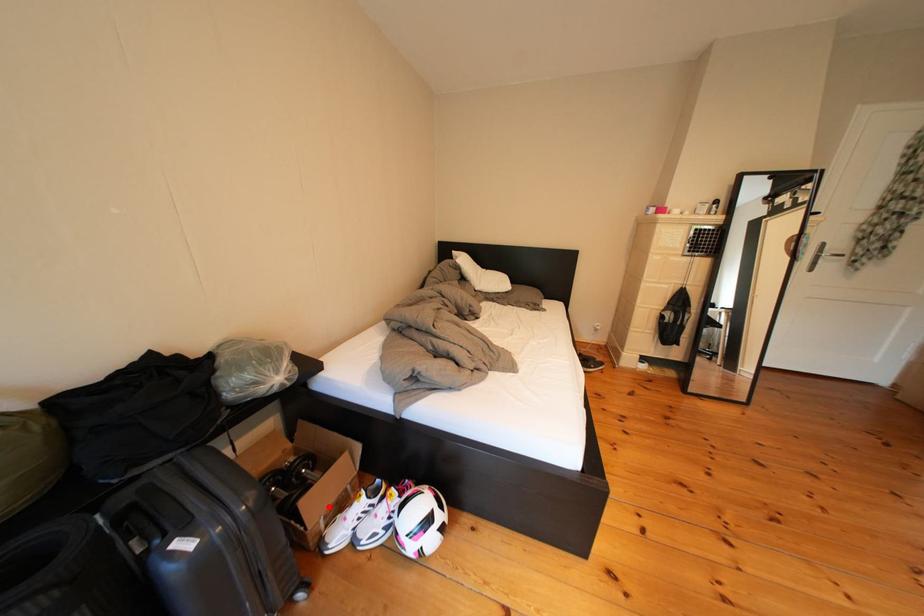
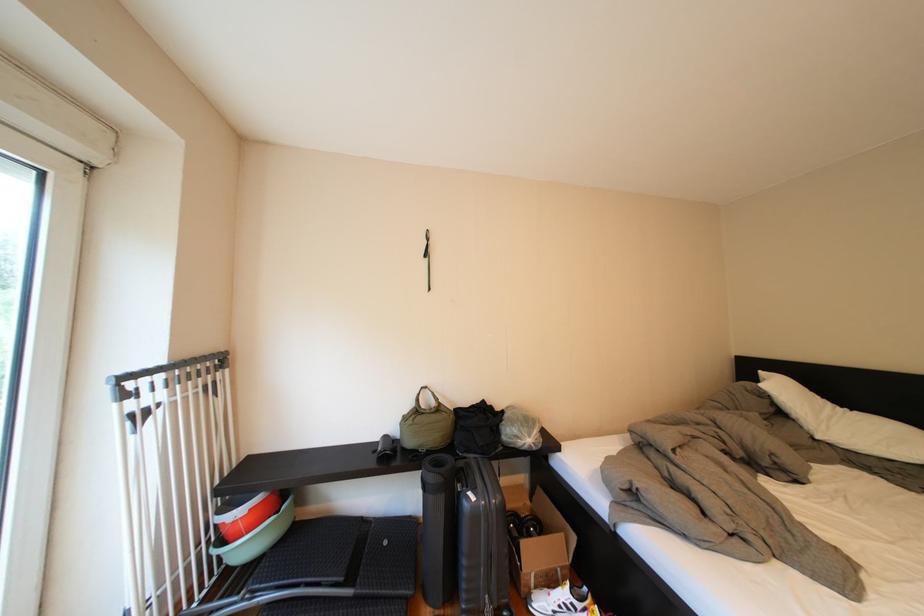
In the second image, find the point that corresponds to the highlighted location in the first image.

(544, 557)